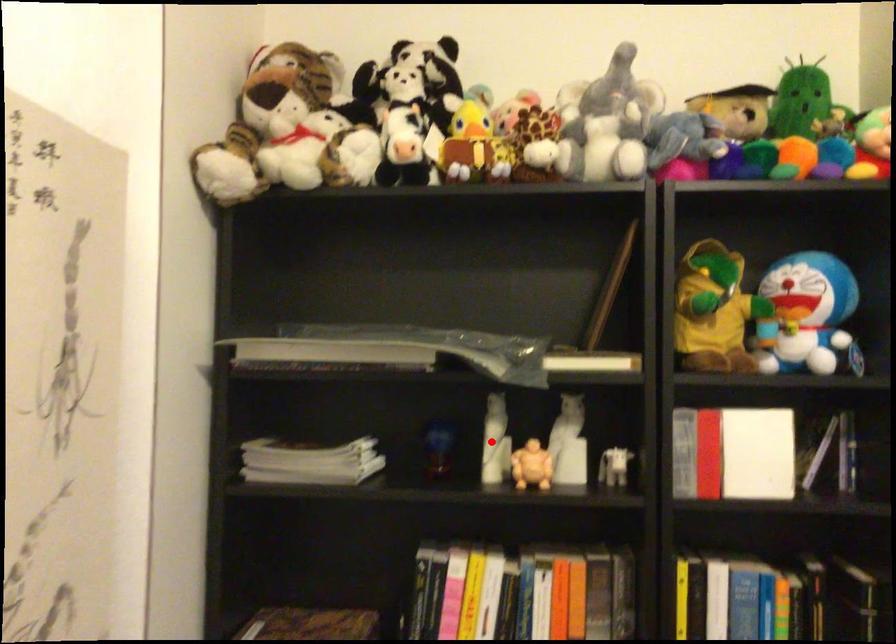
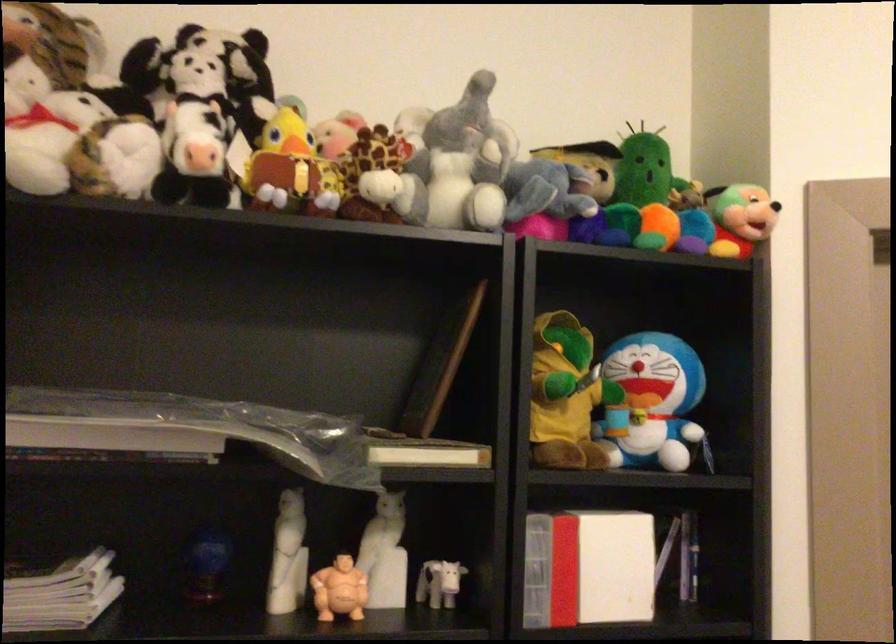
Question: I am providing you with two images of the same scene from different viewpoints. Given a red point in image1, look at the same physical point in image2. Is it:

Choices:
 (A) Closer to the viewpoint
 (B) Farther from the viewpoint

Answer: (A)